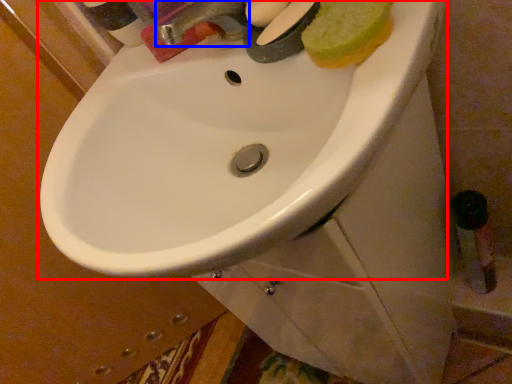
Question: Which of the following is the closest to the observer, sink (highlighted by a red box) or tap (highlighted by a blue box)?

Choices:
 (A) sink
 (B) tap

Answer: (A)